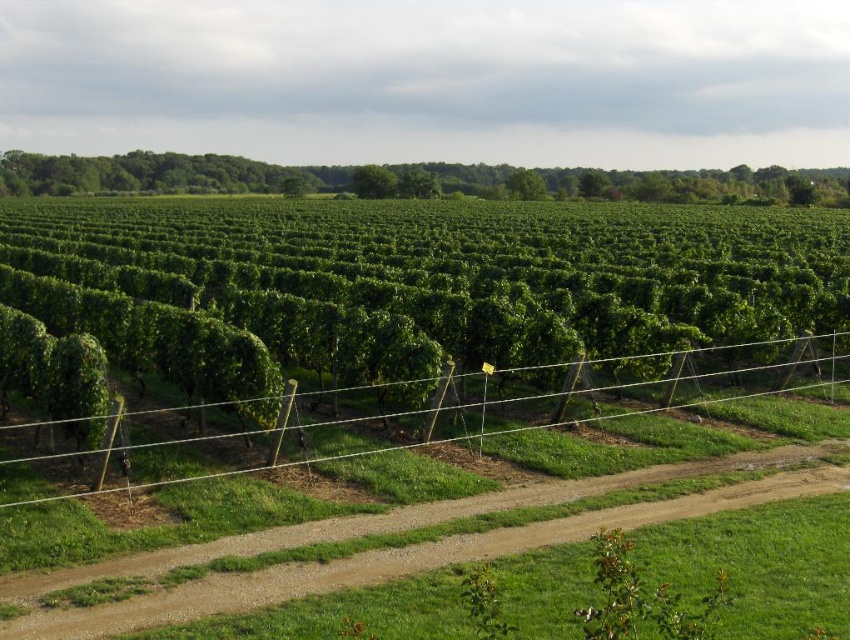
You are a visitor walking along the dirt path in the vineyard. You notice a green leafy hedge at center and a green leafy tree at upper center. Which of these two objects is positioned higher in the image?

The green leafy tree at upper center is positioned higher in the image than the green leafy hedge at center.

You are a gardener working in the vineyard and need to determine which object is taller between the brown gravel path at center and the green leafy tree at center. Which one is taller?

The green leafy tree at center is taller than the brown gravel path at center.

You are standing at the starting point of the dirt path in the vineyard and see two points marked as point 1 at coordinates point [686,284] and point 2 at coordinates point [52,172]. Which point is closer to you?

Point 1 at coordinates point [686,284] is closer to you because it is in front of point 2 at coordinates point [52,172].